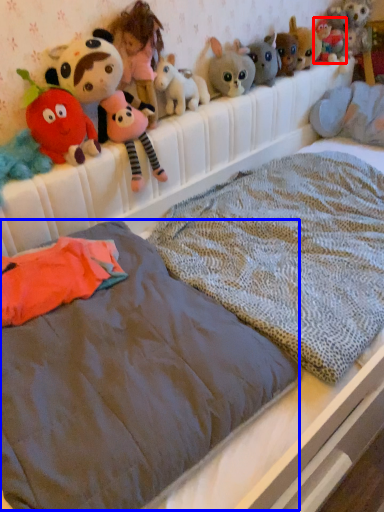
Question: Which point is further to the camera, toy (highlighted by a red box) or mattress (highlighted by a blue box)?

Choices:
 (A) toy
 (B) mattress

Answer: (A)